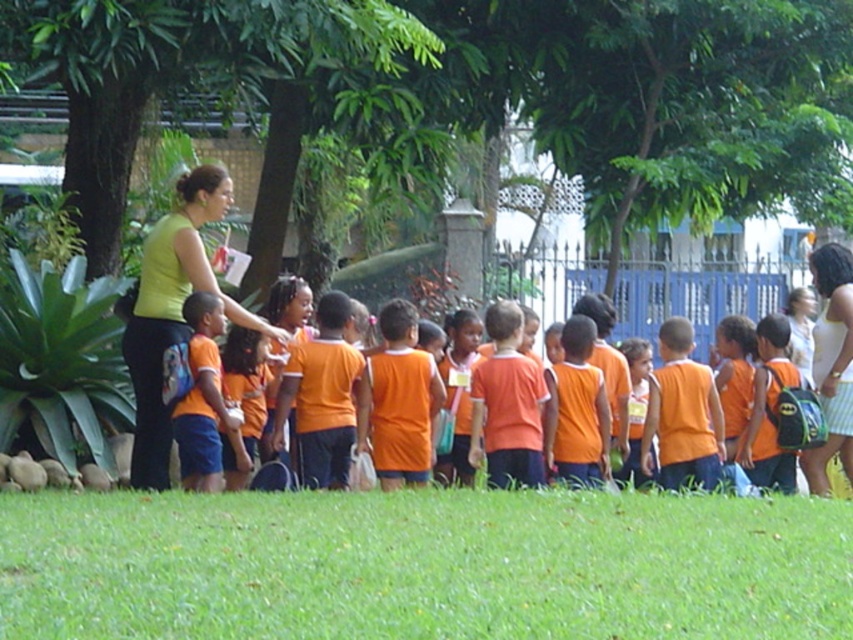
Question: Can you confirm if green leafy tree at upper center is positioned to the right of green grass at lower center?

Choices:
 (A) yes
 (B) no

Answer: (B)

Question: Which object appears farthest from the camera in this image?

Choices:
 (A) green leafy tree at upper center
 (B) green matte shirt at upper left
 (C) orange fabric shirt at left
 (D) batman-patterned backpack at right

Answer: (D)

Question: Is green leafy tree at upper center above orange fabric shirt at left?

Choices:
 (A) yes
 (B) no

Answer: (A)

Question: Can you confirm if green leafy tree at upper center is smaller than orange fabric shirt at left?

Choices:
 (A) yes
 (B) no

Answer: (B)

Question: Which point is closer to the camera?

Choices:
 (A) batman-patterned backpack at right
 (B) orange fabric shirt at left
 (C) green matte shirt at upper left
 (D) green leafy tree at upper center

Answer: (C)

Question: Which object is farther from the camera taking this photo?

Choices:
 (A) orange fabric shirt at left
 (B) batman-patterned backpack at right
 (C) green leafy tree at upper center

Answer: (B)